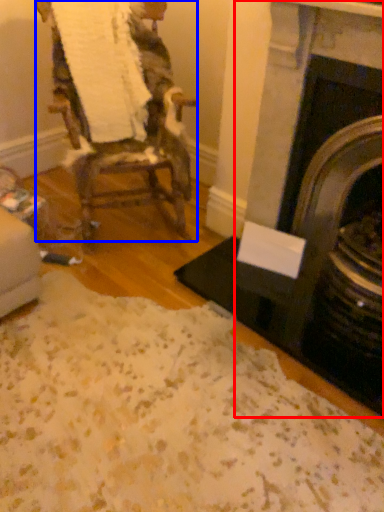
Question: Which object appears closest to the camera in this image, fireplace (highlighted by a red box) or chair (highlighted by a blue box)?

Choices:
 (A) fireplace
 (B) chair

Answer: (A)